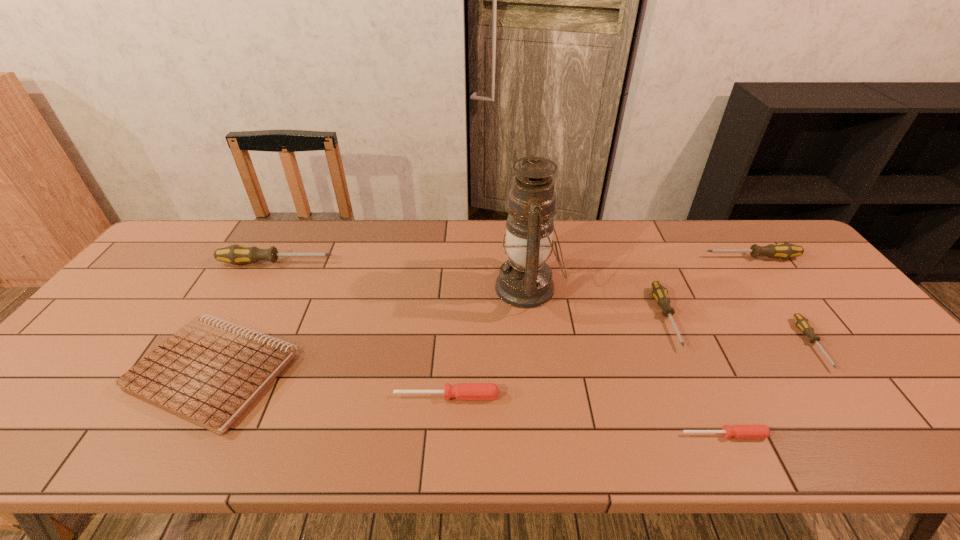
The height and width of the screenshot is (540, 960). Identify the location of blank area at the left edge. (160, 316).

Locate an element on the screen. This screenshot has height=540, width=960. vacant area at the right edge of the desktop is located at coordinates (882, 361).

Locate an element on the screen. free point at the far left corner is located at coordinates (187, 255).

At what (x,y) coordinates should I click in order to perform the action: click on vacant region at the near right corner of the desktop. Please return your answer as a coordinate pair (x, y). The width and height of the screenshot is (960, 540). Looking at the image, I should click on (933, 432).

Where is `empty space that is in between the left red screwdriver and the smallest gray screwdriver`? The width and height of the screenshot is (960, 540). empty space that is in between the left red screwdriver and the smallest gray screwdriver is located at coordinates (629, 370).

You are a GUI agent. You are given a task and a screenshot of the screen. Output one action in this format:
    pyautogui.click(x=<x>, y=<y>)
    Task: Click on the vacant space in between the nearest screwdriver and the leftmost screwdriver
    This screenshot has height=540, width=960.
    Given the screenshot: What is the action you would take?
    pyautogui.click(x=500, y=349)

Image resolution: width=960 pixels, height=540 pixels. What are the coordinates of `free space between the oil lamp and the right red screwdriver` in the screenshot? It's located at (x=626, y=361).

Where is `empty space that is in between the notebook and the fourth shortest screwdriver`? Image resolution: width=960 pixels, height=540 pixels. empty space that is in between the notebook and the fourth shortest screwdriver is located at coordinates (440, 345).

This screenshot has width=960, height=540. What are the coordinates of `vacant region between the notebook and the fifth screwdriver from right to left` in the screenshot? It's located at (329, 384).

Find the location of `vacant space that is in between the notebook and the oil lamp`. vacant space that is in between the notebook and the oil lamp is located at coordinates (371, 329).